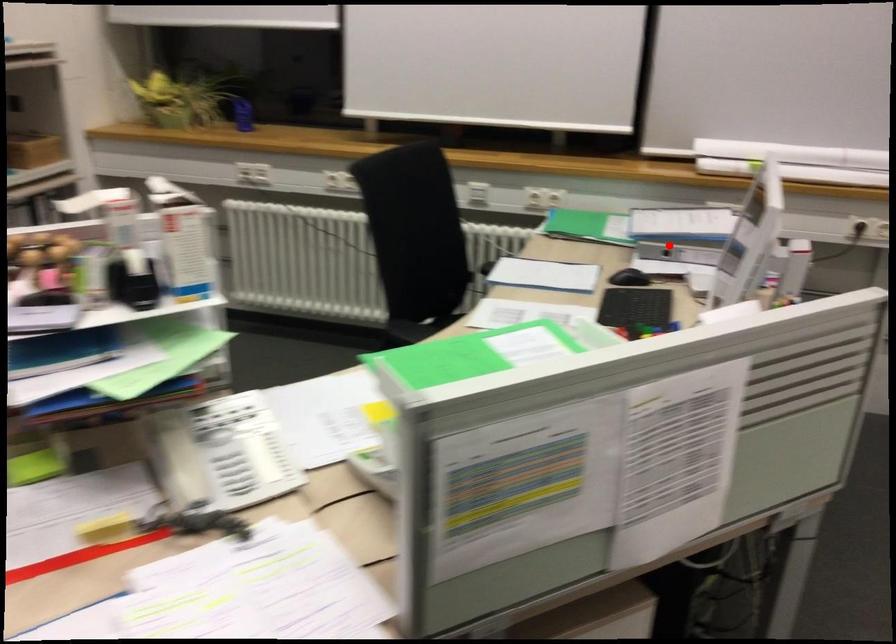
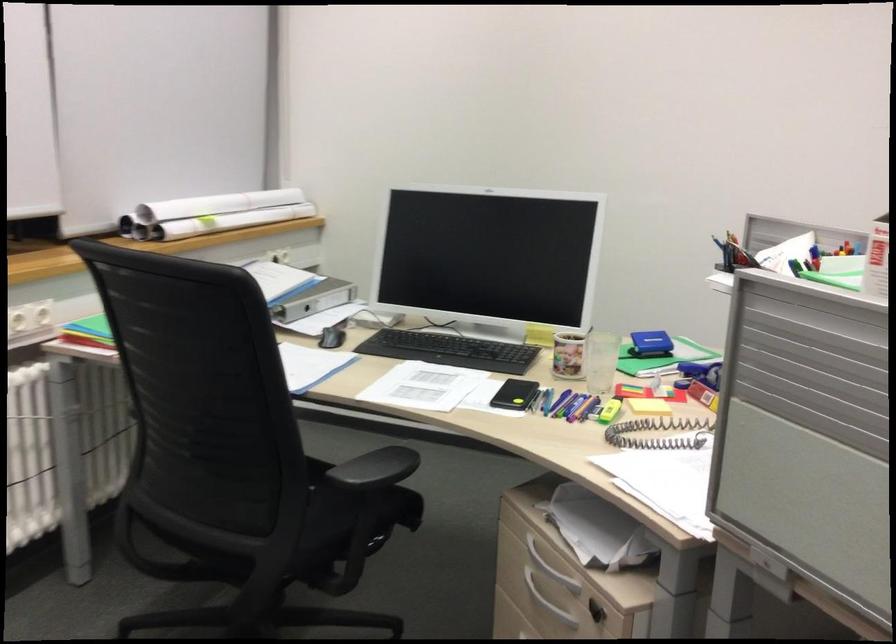
In the second image, find the point that corresponds to the highlighted location in the first image.

(314, 299)